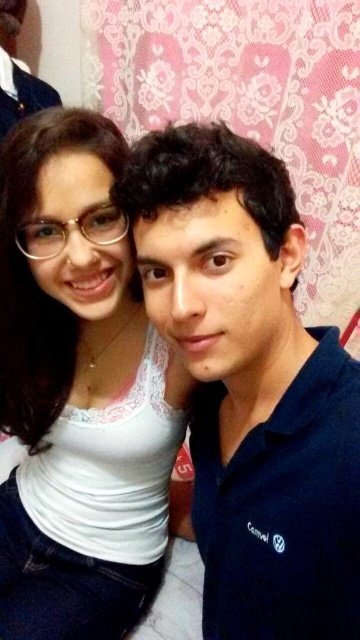
Question: Which is farther from the blue cotton polo shirt at center?

Choices:
 (A) white lace top at upper left
 (B) matte black shirt at upper left

Answer: (B)

Question: Is blue cotton polo shirt at center to the left of matte black shirt at upper left from the viewer's perspective?

Choices:
 (A) yes
 (B) no

Answer: (B)

Question: Can you confirm if blue cotton polo shirt at center is positioned to the left of matte black shirt at upper left?

Choices:
 (A) yes
 (B) no

Answer: (B)

Question: Among these objects, which one is nearest to the camera?

Choices:
 (A) white lace top at upper left
 (B) blue cotton polo shirt at center

Answer: (B)

Question: From the image, what is the correct spatial relationship of white lace top at upper left in relation to matte black shirt at upper left?

Choices:
 (A) below
 (B) above

Answer: (A)

Question: Which object is positioned closest to the white lace top at upper left?

Choices:
 (A) matte black shirt at upper left
 (B) blue cotton polo shirt at center

Answer: (B)